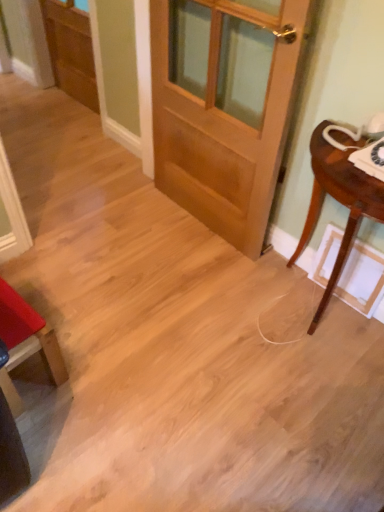
Question: Considering the relative sizes of mahogany wood table at right and matte red chair at lower left in the image provided, is mahogany wood table at right shorter than matte red chair at lower left?

Choices:
 (A) no
 (B) yes

Answer: (A)

Question: Does mahogany wood table at right have a larger size compared to matte red chair at lower left?

Choices:
 (A) no
 (B) yes

Answer: (B)

Question: From a real-world perspective, does mahogany wood table at right stand above matte red chair at lower left?

Choices:
 (A) no
 (B) yes

Answer: (B)

Question: Can you confirm if mahogany wood table at right is taller than matte red chair at lower left?

Choices:
 (A) no
 (B) yes

Answer: (B)

Question: Is mahogany wood table at right positioned behind matte red chair at lower left?

Choices:
 (A) no
 (B) yes

Answer: (A)

Question: From the image's perspective, would you say mahogany wood table at right is shown under matte red chair at lower left?

Choices:
 (A) no
 (B) yes

Answer: (A)

Question: Is matte red chair at lower left at the right side of wooden screen door at upper left?

Choices:
 (A) yes
 (B) no

Answer: (A)

Question: Can you confirm if matte red chair at lower left is thinner than wooden screen door at upper left?

Choices:
 (A) no
 (B) yes

Answer: (A)

Question: Does matte red chair at lower left come in front of wooden screen door at upper left?

Choices:
 (A) yes
 (B) no

Answer: (A)

Question: Does matte red chair at lower left have a greater height compared to wooden screen door at upper left?

Choices:
 (A) no
 (B) yes

Answer: (A)

Question: From a real-world perspective, is matte red chair at lower left positioned under wooden screen door at upper left based on gravity?

Choices:
 (A) yes
 (B) no

Answer: (A)

Question: Is matte red chair at lower left oriented towards wooden screen door at upper left?

Choices:
 (A) no
 (B) yes

Answer: (A)

Question: Considering the relative positions of light brown wood door at center and matte red chair at lower left in the image provided, is light brown wood door at center to the right of matte red chair at lower left from the viewer's perspective?

Choices:
 (A) yes
 (B) no

Answer: (A)